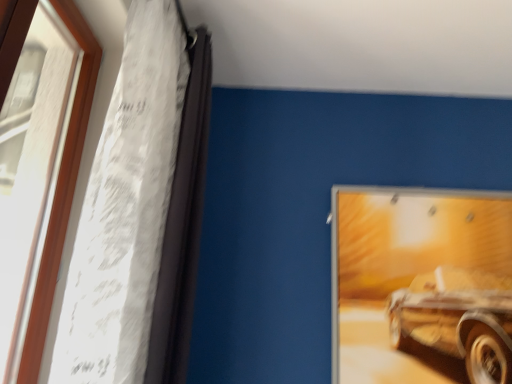
Question: Is wooden frame at left further to the viewer compared to metallic silver picture frame at upper right?

Choices:
 (A) no
 (B) yes

Answer: (A)

Question: From a real-world perspective, is wooden frame at left beneath metallic silver picture frame at upper right?

Choices:
 (A) yes
 (B) no

Answer: (B)

Question: Does wooden frame at left contain metallic silver picture frame at upper right?

Choices:
 (A) yes
 (B) no

Answer: (B)

Question: Does wooden frame at left lie in front of metallic silver picture frame at upper right?

Choices:
 (A) yes
 (B) no

Answer: (A)

Question: Is wooden frame at left at the right side of metallic silver picture frame at upper right?

Choices:
 (A) no
 (B) yes

Answer: (A)

Question: Are wooden frame at left and metallic silver picture frame at upper right making contact?

Choices:
 (A) yes
 (B) no

Answer: (B)

Question: Is wooden frame at left to the left of white sheer fabric at left from the viewer's perspective?

Choices:
 (A) no
 (B) yes

Answer: (B)

Question: Is wooden frame at left outside of white sheer fabric at left?

Choices:
 (A) no
 (B) yes

Answer: (B)

Question: Considering the relative sizes of wooden frame at left and white sheer fabric at left in the image provided, is wooden frame at left smaller than white sheer fabric at left?

Choices:
 (A) no
 (B) yes

Answer: (B)

Question: Could you tell me if wooden frame at left is turned towards white sheer fabric at left?

Choices:
 (A) yes
 (B) no

Answer: (A)

Question: Is wooden frame at left taller than white sheer fabric at left?

Choices:
 (A) no
 (B) yes

Answer: (A)

Question: Considering the relative sizes of wooden frame at left and white sheer fabric at left in the image provided, is wooden frame at left thinner than white sheer fabric at left?

Choices:
 (A) yes
 (B) no

Answer: (A)

Question: Does white sheer fabric at left have a greater width compared to metallic silver picture frame at upper right?

Choices:
 (A) no
 (B) yes

Answer: (B)